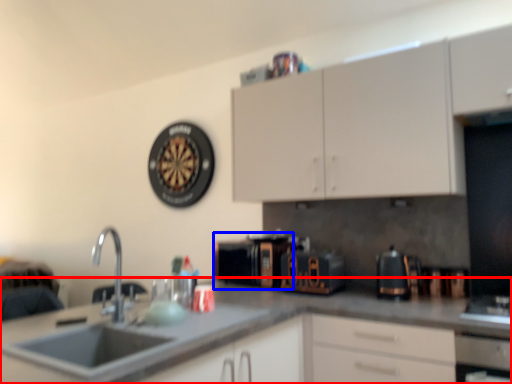
Question: Among these objects, which one is nearest to the camera, countertop (highlighted by a red box) or appliance (highlighted by a blue box)?

Choices:
 (A) countertop
 (B) appliance

Answer: (A)